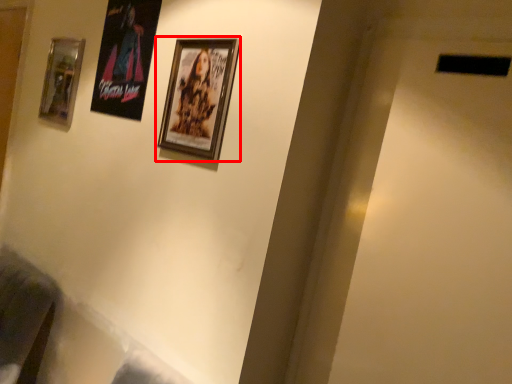
Question: Observing the image, what is the correct spatial positioning of picture frame (annotated by the red box) in reference to picture frame?

Choices:
 (A) left
 (B) right

Answer: (B)